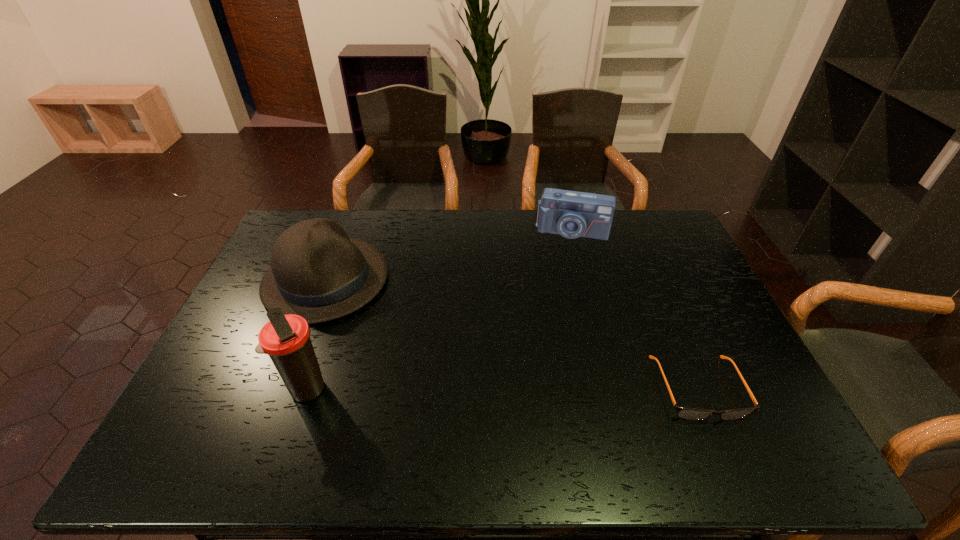
Find the location of `object located at the near right corner`. object located at the near right corner is located at coordinates (686, 413).

In the image, there is a desktop. Where is `vacant space at the far edge`? The width and height of the screenshot is (960, 540). vacant space at the far edge is located at coordinates (489, 234).

Where is `vacant region at the right edge`? The width and height of the screenshot is (960, 540). vacant region at the right edge is located at coordinates (696, 279).

In the image, there is a desktop. At what (x,y) coordinates should I click in order to perform the action: click on vacant region at the near left corner. Please return your answer as a coordinate pair (x, y). Looking at the image, I should click on (209, 393).

Image resolution: width=960 pixels, height=540 pixels. Identify the location of vacant space at the far right corner of the desktop. pos(629,219).

What are the coordinates of `empty space between the second farthest object and the camera` in the screenshot? It's located at (449, 255).

Identify the location of vacant area that lies between the spectacles and the second shortest object. The image size is (960, 540). (635, 309).

The height and width of the screenshot is (540, 960). Find the location of `vacant space that's between the third tallest object and the thermos bottle`. vacant space that's between the third tallest object and the thermos bottle is located at coordinates (440, 310).

At what (x,y) coordinates should I click in order to perform the action: click on blank region between the second farthest object and the thermos bottle. Please return your answer as a coordinate pair (x, y). The height and width of the screenshot is (540, 960). Looking at the image, I should click on (317, 335).

Find the location of a particular element. The image size is (960, 540). vacant point located between the shortest object and the camera is located at coordinates (635, 309).